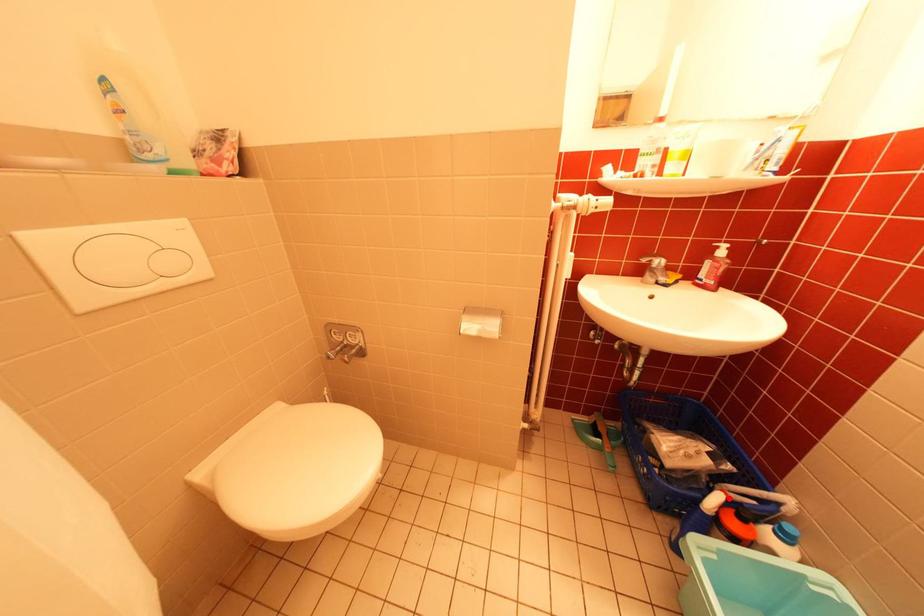
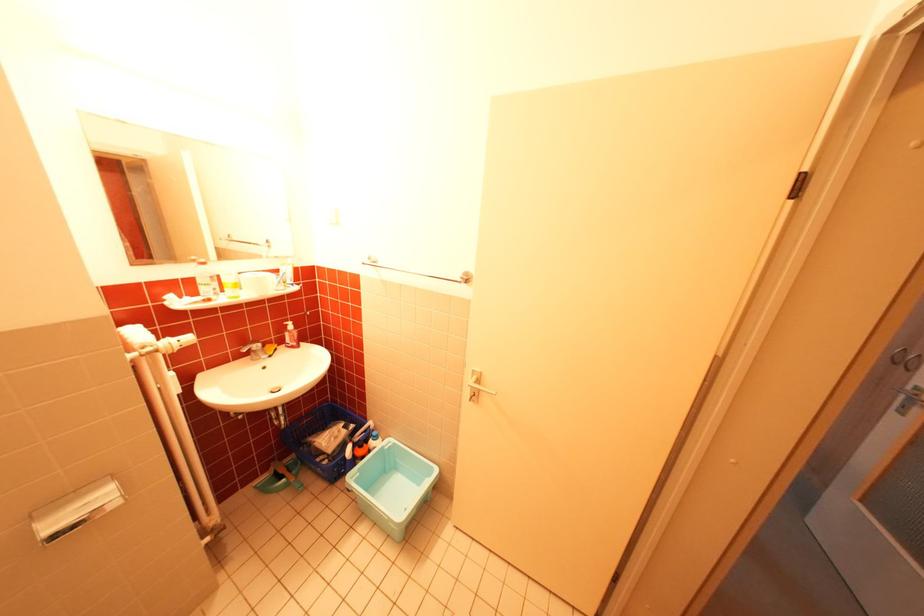
Question: I am providing you with two images of the same scene from different viewpoints. A red point is shown in image1. For the corresponding object point in image2, is it positioned nearer or farther from the camera?

Choices:
 (A) Nearer
 (B) Farther

Answer: (B)